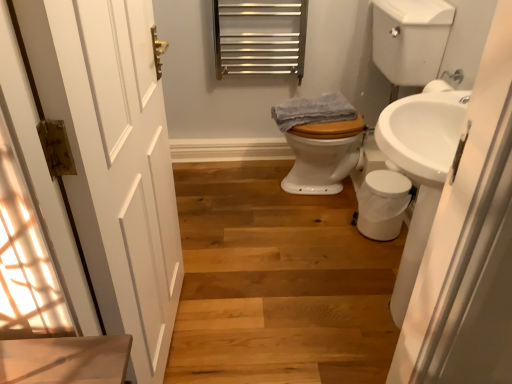
Question: Does white wooden door at left come behind white glossy toilet at center?

Choices:
 (A) yes
 (B) no

Answer: (B)

Question: Is white wooden door at left oriented towards white glossy toilet at center?

Choices:
 (A) yes
 (B) no

Answer: (B)

Question: Does white wooden door at left touch white glossy toilet at center?

Choices:
 (A) yes
 (B) no

Answer: (B)

Question: Does white wooden door at left have a larger size compared to white glossy toilet at center?

Choices:
 (A) no
 (B) yes

Answer: (A)

Question: Is white wooden door at left at the right side of white glossy toilet at center?

Choices:
 (A) no
 (B) yes

Answer: (A)

Question: Is wooden stairs at lower left in front of or behind white glossy sink at right in the image?

Choices:
 (A) front
 (B) behind

Answer: (B)

Question: From the image's perspective, is wooden stairs at lower left positioned above or below white glossy sink at right?

Choices:
 (A) below
 (B) above

Answer: (A)

Question: From their relative heights in the image, would you say wooden stairs at lower left is taller or shorter than white glossy sink at right?

Choices:
 (A) short
 (B) tall

Answer: (A)

Question: Considering the positions of wooden stairs at lower left and white glossy sink at right in the image, is wooden stairs at lower left wider or thinner than white glossy sink at right?

Choices:
 (A) wide
 (B) thin

Answer: (A)

Question: From a real-world perspective, is white wooden door at left above or below gray cotton towel at center?

Choices:
 (A) above
 (B) below

Answer: (A)

Question: Considering the positions of white wooden door at left and gray cotton towel at center in the image, is white wooden door at left taller or shorter than gray cotton towel at center?

Choices:
 (A) tall
 (B) short

Answer: (A)

Question: Is white wooden door at left in front of or behind gray cotton towel at center in the image?

Choices:
 (A) front
 (B) behind

Answer: (A)

Question: From the image's perspective, is white wooden door at left above or below gray cotton towel at center?

Choices:
 (A) below
 (B) above

Answer: (A)

Question: Is white glossy sink at right inside or outside of gray cotton towel at center?

Choices:
 (A) inside
 (B) outside

Answer: (B)

Question: From their relative heights in the image, would you say white glossy sink at right is taller or shorter than gray cotton towel at center?

Choices:
 (A) tall
 (B) short

Answer: (A)